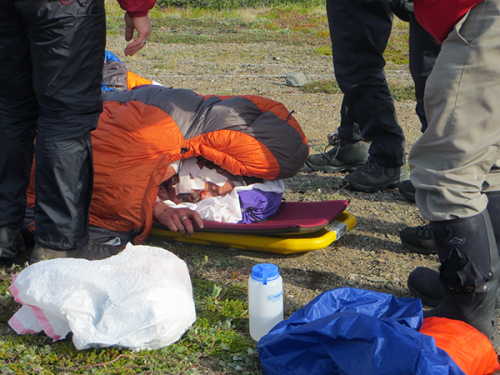
You are a GUI agent. You are given a task and a screenshot of the screen. Output one action in this format:
    pyautogui.click(x=<x>, y=<y>)
    Task: Click on the bottle
    The height and width of the screenshot is (375, 500).
    Given the screenshot: What is the action you would take?
    pyautogui.click(x=267, y=290)